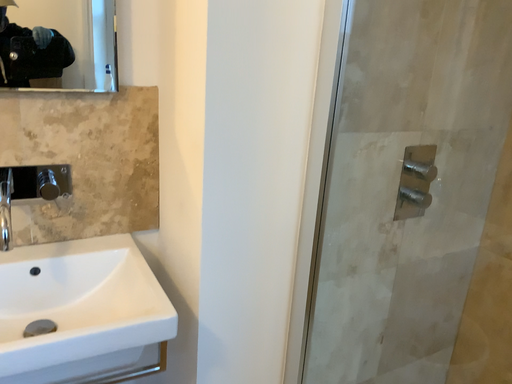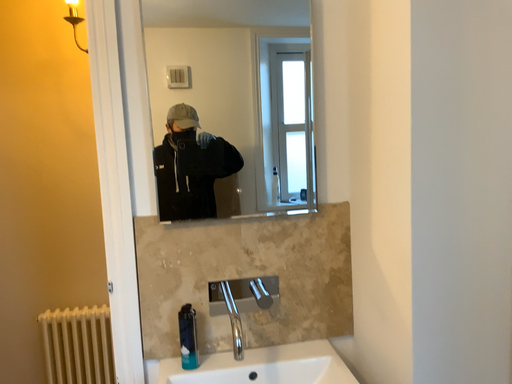
Question: Which way did the camera rotate in the video?

Choices:
 (A) rotated upward
 (B) rotated downward

Answer: (A)